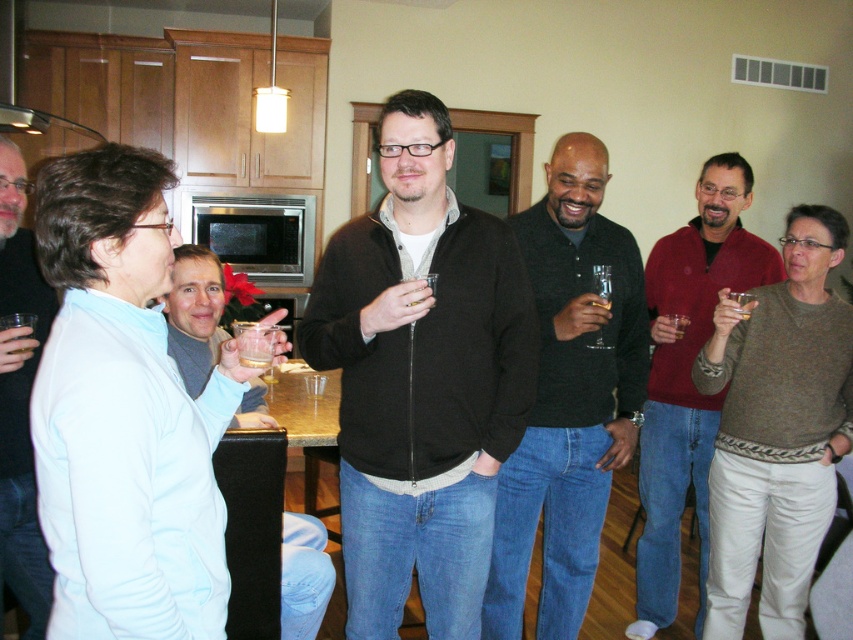
From the picture: Does matte red sweater at center have a lesser width compared to clear glass wine glass at center?

No, matte red sweater at center is not thinner than clear glass wine glass at center.

Is point (640, 611) positioned in front of point (601, 340)?

No, (640, 611) is behind (601, 340).

The image size is (853, 640). Identify the location of matte red sweater at center. (688, 378).

Between matte red sweater at center and translucent plastic cup at center, which one appears on the left side from the viewer's perspective?

Positioned to the left is translucent plastic cup at center.

What do you see at coordinates (688, 378) in the screenshot?
I see `matte red sweater at center` at bounding box center [688, 378].

Is point (701, 410) behind point (268, 358)?

Yes.

Locate an element on the screen. matte red sweater at center is located at coordinates (688, 378).

Measure the distance between matte red sweater at center and matte black jacket at center.

A distance of 1.86 meters exists between matte red sweater at center and matte black jacket at center.

Does matte red sweater at center have a greater width compared to matte black jacket at center?

Correct, the width of matte red sweater at center exceeds that of matte black jacket at center.

Identify the location of matte red sweater at center. (688, 378).